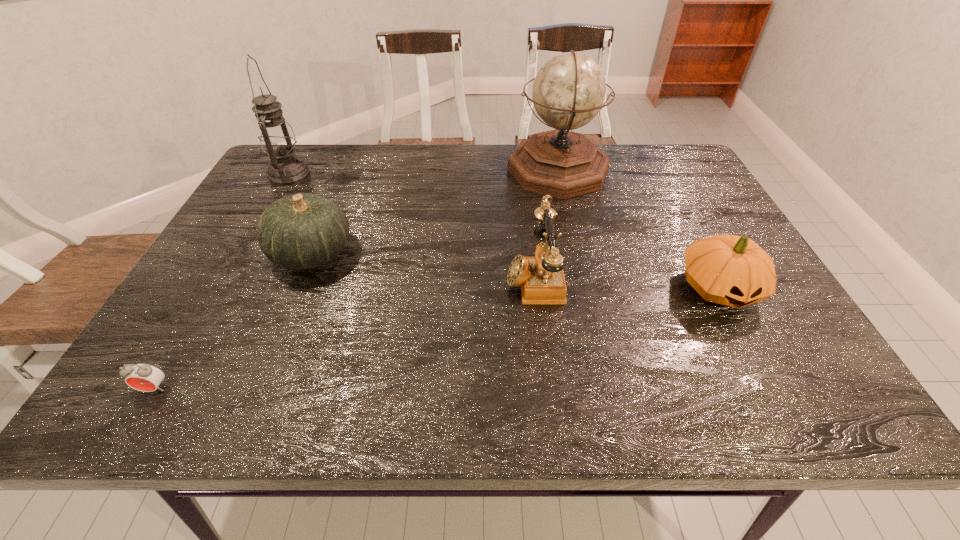
This screenshot has height=540, width=960. What are the coordinates of `vacant point located 0.240m on the right of the oil lamp` in the screenshot? It's located at (390, 173).

Locate an element on the screen. Image resolution: width=960 pixels, height=540 pixels. vacant space situated 0.270m on the dial number of the telephone is located at coordinates (388, 276).

I want to click on free space located on the dial number of the telephone, so click(458, 276).

You are a GUI agent. You are given a task and a screenshot of the screen. Output one action in this format:
    pyautogui.click(x=<x>, y=<y>)
    Task: Click on the vacant space located 0.090m on the dial number of the telephone
    This screenshot has height=540, width=960.
    Given the screenshot: What is the action you would take?
    pyautogui.click(x=467, y=276)

Locate an element on the screen. The height and width of the screenshot is (540, 960). vacant space located 0.330m on the back of the third object from left to right is located at coordinates (349, 160).

Locate an element on the screen. vacant space located on the side of the rightmost object with the carved face is located at coordinates (782, 409).

Image resolution: width=960 pixels, height=540 pixels. I want to click on globe located at the far edge, so click(569, 90).

Find the location of a particular element. The height and width of the screenshot is (540, 960). oil lamp at the far edge is located at coordinates (277, 138).

Where is `object that is at the near edge`? This screenshot has height=540, width=960. object that is at the near edge is located at coordinates (144, 377).

Locate an element on the screen. This screenshot has height=540, width=960. oil lamp located at the left edge is located at coordinates (277, 138).